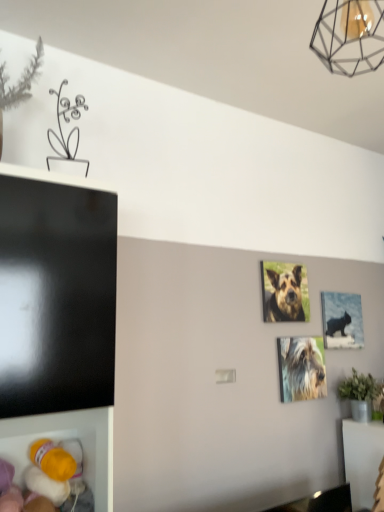
Question: Can you confirm if metallic wireframe lamp at upper right is thinner than metallic silver picture frame at center-right?

Choices:
 (A) no
 (B) yes

Answer: (A)

Question: From a real-world perspective, is metallic wireframe lamp at upper right positioned under metallic silver picture frame at center-right based on gravity?

Choices:
 (A) no
 (B) yes

Answer: (A)

Question: Is metallic wireframe lamp at upper right located outside metallic silver picture frame at center-right?

Choices:
 (A) yes
 (B) no

Answer: (A)

Question: From the image's perspective, would you say metallic wireframe lamp at upper right is positioned over metallic silver picture frame at center-right?

Choices:
 (A) yes
 (B) no

Answer: (A)

Question: Is metallic wireframe lamp at upper right positioned behind metallic silver picture frame at center-right?

Choices:
 (A) no
 (B) yes

Answer: (A)

Question: Considering the positions of metallic silver picture frame at center-right and metallic wireframe lamp at upper right in the image, is metallic silver picture frame at center-right wider or thinner than metallic wireframe lamp at upper right?

Choices:
 (A) wide
 (B) thin

Answer: (B)

Question: Is metallic silver picture frame at center-right to the left or to the right of metallic wireframe lamp at upper right in the image?

Choices:
 (A) right
 (B) left

Answer: (A)

Question: Is metallic silver picture frame at center-right spatially inside metallic wireframe lamp at upper right, or outside of it?

Choices:
 (A) inside
 (B) outside

Answer: (B)

Question: Considering the positions of point (327, 318) and point (329, 50), is point (327, 318) closer or farther from the camera than point (329, 50)?

Choices:
 (A) farther
 (B) closer

Answer: (A)

Question: Would you say shaggy fur dog at center, the 1th dog positioned from the bottom, is inside or outside brown fur dog at center, positioned as the first dog in top-to-bottom order?

Choices:
 (A) outside
 (B) inside

Answer: (A)

Question: Is shaggy fur dog at center, the second dog in the top-to-bottom sequence, in front of or behind brown fur dog at center, positioned as the first dog in top-to-bottom order, in the image?

Choices:
 (A) behind
 (B) front

Answer: (B)

Question: From the image's perspective, is shaggy fur dog at center, the 1th dog positioned from the bottom, positioned above or below brown fur dog at center, marked as the 2th dog in a bottom-to-top arrangement?

Choices:
 (A) below
 (B) above

Answer: (A)

Question: From a real-world perspective, relative to brown fur dog at center, marked as the 2th dog in a bottom-to-top arrangement, is shaggy fur dog at center, the second dog in the top-to-bottom sequence, vertically above or below?

Choices:
 (A) above
 (B) below

Answer: (B)

Question: Considering the positions of metallic wireframe lamp at upper right and metallic silver picture frame at center-right in the image, is metallic wireframe lamp at upper right taller or shorter than metallic silver picture frame at center-right?

Choices:
 (A) short
 (B) tall

Answer: (A)

Question: Which is correct: metallic wireframe lamp at upper right is inside metallic silver picture frame at center-right, or outside of it?

Choices:
 (A) inside
 (B) outside

Answer: (B)